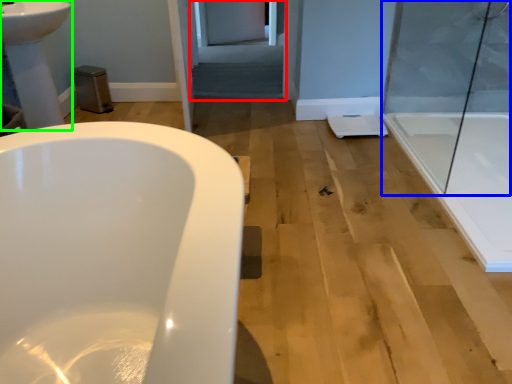
Question: Which object is positioned closest to screen door (highlighted by a red box)? Select from shower door (highlighted by a blue box) and sink (highlighted by a green box).

Choices:
 (A) shower door
 (B) sink

Answer: (A)